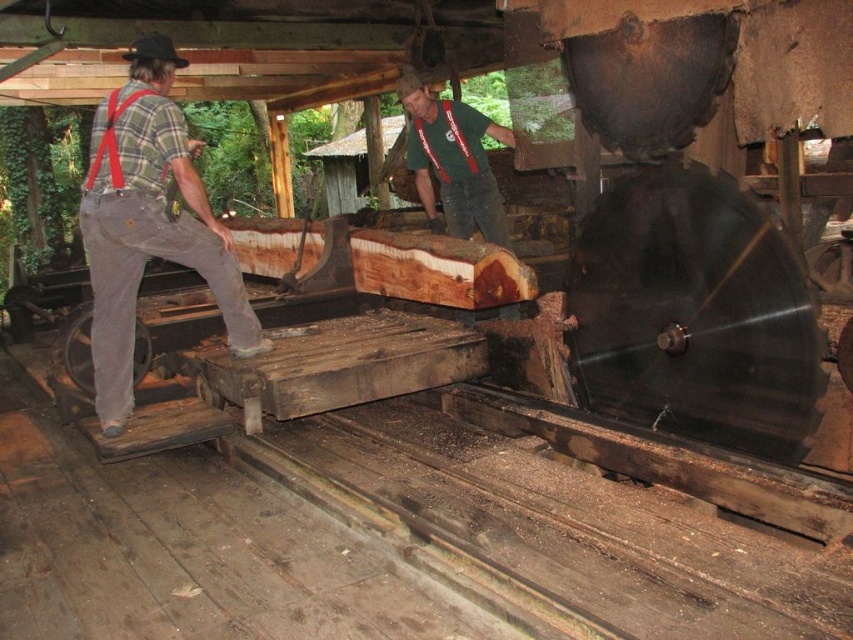
Question: Among these points, which one is farthest from the camera?

Choices:
 (A) (109, 416)
 (B) (450, 141)

Answer: (B)

Question: Where is plaid flannel shirt at left located in relation to green fabric shirt at center in the image?

Choices:
 (A) below
 (B) above

Answer: (A)

Question: Does plaid flannel shirt at left have a smaller size compared to green fabric shirt at center?

Choices:
 (A) no
 (B) yes

Answer: (B)

Question: Does plaid flannel shirt at left come in front of green fabric shirt at center?

Choices:
 (A) yes
 (B) no

Answer: (A)